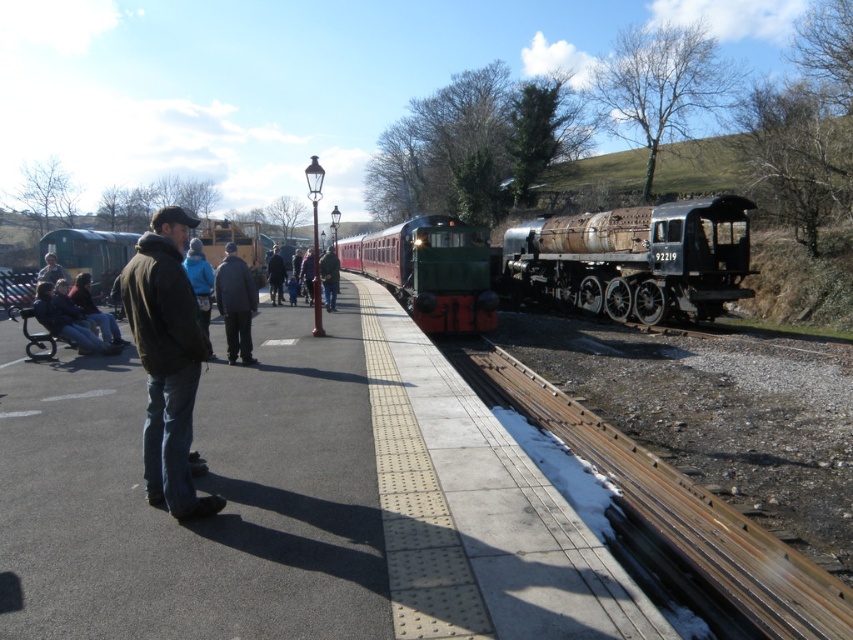
You are a railway engineer who needs to determine which train has a smaller width between the green polished wood train at center and the green matte train at left. Based on the scene, which one is narrower?

The green polished wood train at center has a smaller width than the green matte train at left according to the description.

What is located at the coordinates point (67, 320)?

Dark blue jeans at left is located at point (67, 320).

You are a photographer standing on the platform at the railway station. You want to take a photo of the dark brown leather jacket at left and dark blue jeans at left. Which object should you zoom in on to capture more detail without moving the camera?

The dark brown leather jacket at left has a lesser width compared to dark blue jeans at left, so you should zoom in on the dark brown leather jacket at left to capture more detail without moving the camera because it is smaller and requires closer focus.